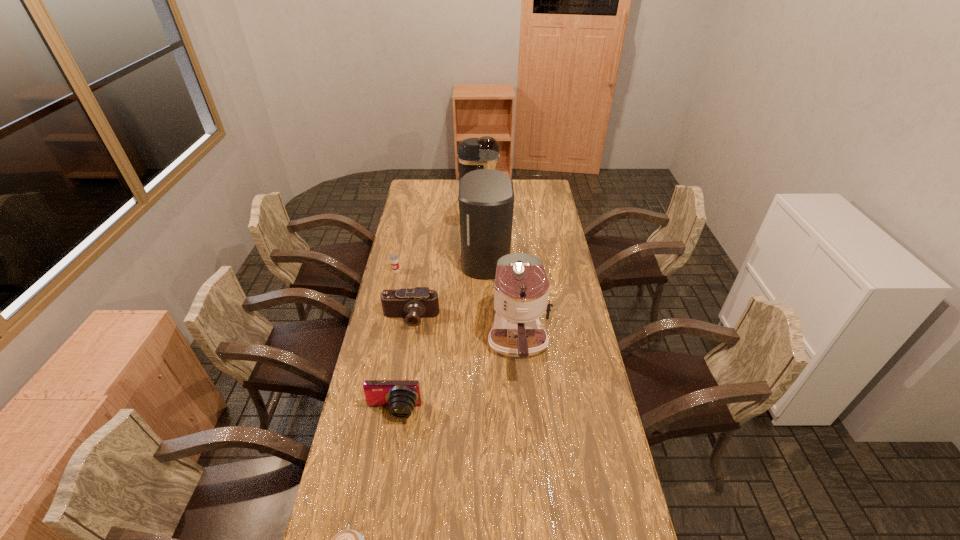
I want to click on the second farthest coffee maker, so click(486, 196).

Where is `the farthest object`? the farthest object is located at coordinates (473, 153).

You are a GUI agent. You are given a task and a screenshot of the screen. Output one action in this format:
    pyautogui.click(x=<x>, y=<y>)
    Task: Click on the nearest coffee maker
    The width and height of the screenshot is (960, 540).
    Given the screenshot: What is the action you would take?
    [521, 291]

The width and height of the screenshot is (960, 540). I want to click on the farther camera, so click(412, 304).

You are a GUI agent. You are given a task and a screenshot of the screen. Output one action in this format:
    pyautogui.click(x=<x>, y=<y>)
    Task: Click on the nearer camera
    Image resolution: width=960 pixels, height=540 pixels.
    Given the screenshot: What is the action you would take?
    pyautogui.click(x=400, y=396)

Image resolution: width=960 pixels, height=540 pixels. In order to click on cup in this screenshot , I will do `click(394, 259)`.

You are a GUI agent. You are given a task and a screenshot of the screen. Output one action in this format:
    pyautogui.click(x=<x>, y=<y>)
    Task: Click on the vacant space situated 0.330m on the button side of the second nearest coffee maker
    
    Given the screenshot: What is the action you would take?
    pyautogui.click(x=391, y=259)

The image size is (960, 540). Identify the location of vacant space located on the button side of the second nearest coffee maker. (445, 259).

This screenshot has height=540, width=960. Identify the location of free location located on the button side of the second nearest coffee maker. (439, 259).

Where is `vacant area situated 0.270m place cup under the spout of the farthest object`? vacant area situated 0.270m place cup under the spout of the farthest object is located at coordinates (546, 199).